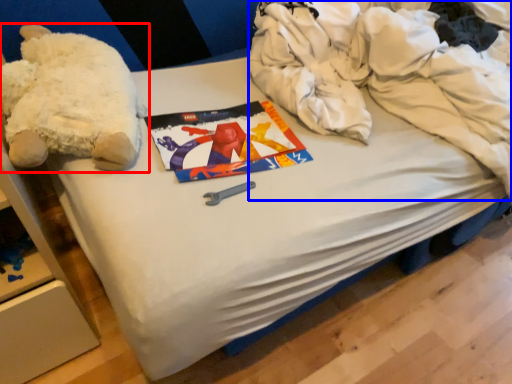
Question: Among these objects, which one is farthest to the camera, teddy bear (highlighted by a red box) or clothing (highlighted by a blue box)?

Choices:
 (A) teddy bear
 (B) clothing

Answer: (A)